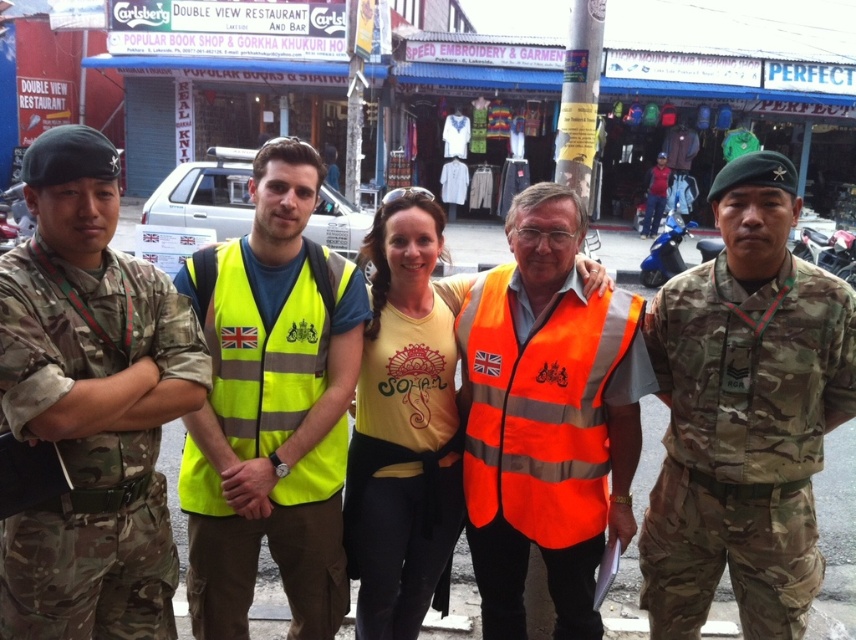
Does orange reflective safety vest at center have a lesser height compared to yellow reflective safety vest at center?

Incorrect, orange reflective safety vest at center's height does not fall short of yellow reflective safety vest at center's.

Is orange reflective safety vest at center closer to the viewer compared to yellow reflective safety vest at center?

That is True.

Does point (486, 465) come farther from viewer compared to point (428, 416)?

No, (486, 465) is in front of (428, 416).

This screenshot has width=856, height=640. I want to click on orange reflective safety vest at center, so click(x=539, y=408).

Does camouflage uniform at left have a larger size compared to camo uniform at right?

No, camouflage uniform at left is not bigger than camo uniform at right.

Does camouflage uniform at left have a smaller size compared to camo uniform at right?

Correct, camouflage uniform at left occupies less space than camo uniform at right.

Measure the distance between camouflage uniform at left and camera.

A distance of 2.64 meters exists between camouflage uniform at left and camera.

Locate an element on the screen. camouflage uniform at left is located at coordinates (90, 404).

Is the position of yellow reflective vest at center less distant than that of yellow fabric tank top at center?

Yes, it is.

What do you see at coordinates (271, 406) in the screenshot? I see `yellow reflective vest at center` at bounding box center [271, 406].

Locate an element on the screen. The height and width of the screenshot is (640, 856). yellow reflective vest at center is located at coordinates (271, 406).